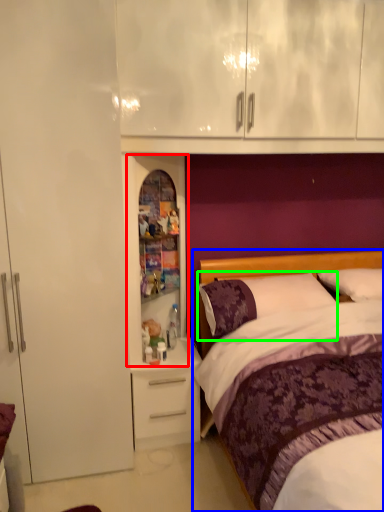
Question: Which is nearer to the medicine cabinet (highlighted by a red box)? bed (highlighted by a blue box) or pillow (highlighted by a green box).

Choices:
 (A) bed
 (B) pillow

Answer: (B)